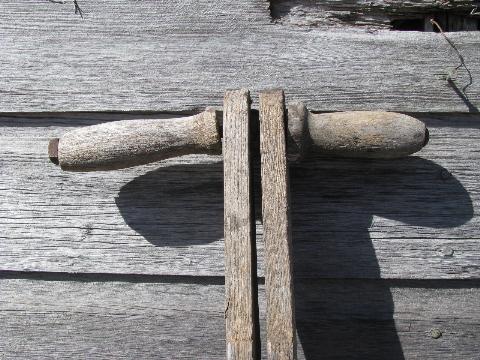
This screenshot has width=480, height=360. In order to click on right handle in this screenshot , I will do `click(395, 137)`.